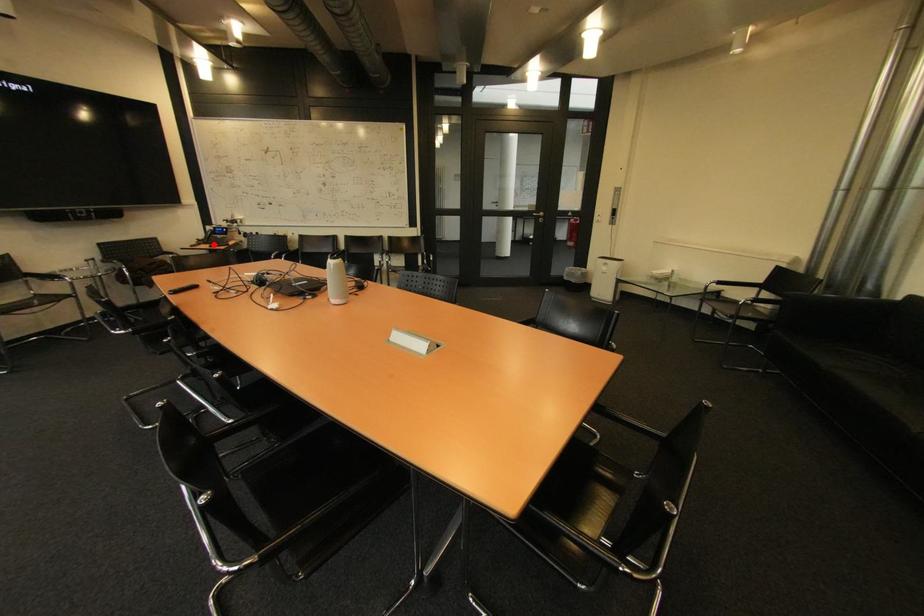
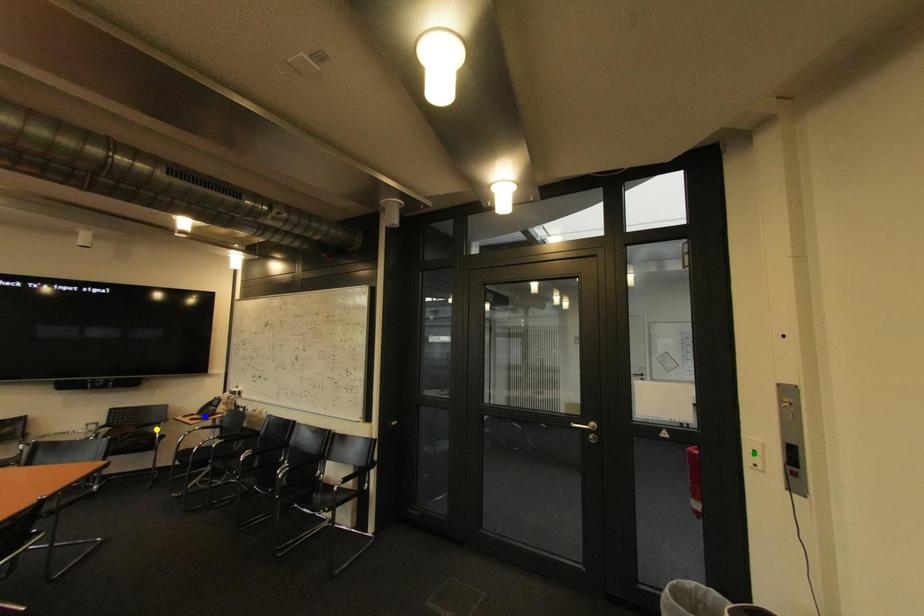
Question: I am providing you with two images of the same scene from different viewpoints. A red point is marked on the first image. You are given multiple points on the second image. Which point in image 2 represents the same 3d spot as the red point in image 1?

Choices:
 (A) green point
 (B) blue point
 (C) yellow point

Answer: (B)